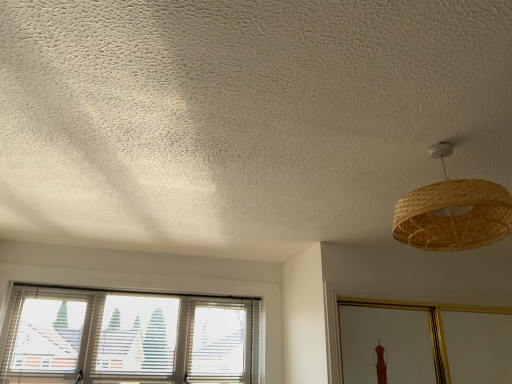
Question: Is bamboo woven lampshade at upper right closer to the viewer compared to white textured blinds at lower left?

Choices:
 (A) yes
 (B) no

Answer: (A)

Question: Is bamboo woven lampshade at upper right oriented away from white textured blinds at lower left?

Choices:
 (A) no
 (B) yes

Answer: (B)

Question: Would you say bamboo woven lampshade at upper right is a long distance from white textured blinds at lower left?

Choices:
 (A) no
 (B) yes

Answer: (B)

Question: Is bamboo woven lampshade at upper right wider than white textured blinds at lower left?

Choices:
 (A) yes
 (B) no

Answer: (A)

Question: Does bamboo woven lampshade at upper right have a larger size compared to white textured blinds at lower left?

Choices:
 (A) no
 (B) yes

Answer: (A)

Question: Considering the relative sizes of bamboo woven lampshade at upper right and white textured blinds at lower left in the image provided, is bamboo woven lampshade at upper right taller than white textured blinds at lower left?

Choices:
 (A) no
 (B) yes

Answer: (A)

Question: Does white textured blinds at lower left appear on the right side of bamboo woven lampshade at upper right?

Choices:
 (A) yes
 (B) no

Answer: (B)

Question: Does white textured blinds at lower left have a lesser width compared to bamboo woven lampshade at upper right?

Choices:
 (A) yes
 (B) no

Answer: (A)

Question: Is white textured blinds at lower left oriented towards bamboo woven lampshade at upper right?

Choices:
 (A) no
 (B) yes

Answer: (B)

Question: Is white textured blinds at lower left facing away from bamboo woven lampshade at upper right?

Choices:
 (A) no
 (B) yes

Answer: (A)

Question: From a real-world perspective, does white textured blinds at lower left sit lower than bamboo woven lampshade at upper right?

Choices:
 (A) yes
 (B) no

Answer: (A)

Question: Can bamboo woven lampshade at upper right be found inside white textured blinds at lower left?

Choices:
 (A) no
 (B) yes

Answer: (A)

Question: Is white textured blinds at lower left to the left or to the right of bamboo woven lampshade at upper right in the image?

Choices:
 (A) right
 (B) left

Answer: (B)